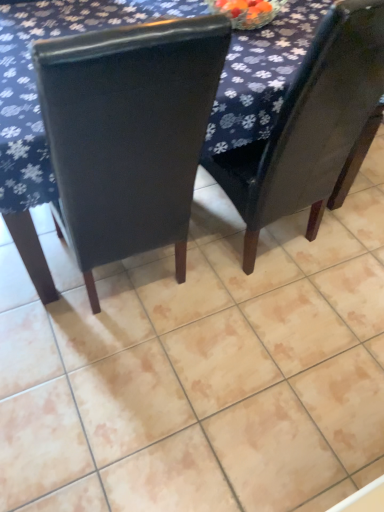
Question: Considering the relative sizes of matte black chair at center, acting as the 1th chair starting from the right, and dark blue fabric at upper center in the image provided, is matte black chair at center, acting as the 1th chair starting from the right, shorter than dark blue fabric at upper center?

Choices:
 (A) no
 (B) yes

Answer: (A)

Question: From the image's perspective, is matte black chair at center, which ranks as the second chair in left-to-right order, over dark blue fabric at upper center?

Choices:
 (A) yes
 (B) no

Answer: (B)

Question: Can you confirm if matte black chair at center, acting as the 1th chair starting from the right, is positioned to the right of dark blue fabric at upper center?

Choices:
 (A) no
 (B) yes

Answer: (B)

Question: From a real-world perspective, is matte black chair at center, acting as the 1th chair starting from the right, below dark blue fabric at upper center?

Choices:
 (A) yes
 (B) no

Answer: (B)

Question: Does matte black chair at center, acting as the 1th chair starting from the right, come in front of dark blue fabric at upper center?

Choices:
 (A) yes
 (B) no

Answer: (A)

Question: Is matte black chair at center, which ranks as the second chair in left-to-right order, in contact with dark blue fabric at upper center?

Choices:
 (A) no
 (B) yes

Answer: (A)

Question: Does matte black chair at center, which ranks as the second chair in left-to-right order, have a greater height compared to matte black chair at center, which appears as the 1th chair when viewed from the left?

Choices:
 (A) yes
 (B) no

Answer: (A)

Question: From the image's perspective, is matte black chair at center, which ranks as the second chair in left-to-right order, beneath matte black chair at center, which appears as the 1th chair when viewed from the left?

Choices:
 (A) no
 (B) yes

Answer: (A)

Question: Does matte black chair at center, acting as the 1th chair starting from the right, touch matte black chair at center, acting as the 2th chair starting from the right?

Choices:
 (A) yes
 (B) no

Answer: (B)

Question: Can you confirm if matte black chair at center, which ranks as the second chair in left-to-right order, is wider than matte black chair at center, which appears as the 1th chair when viewed from the left?

Choices:
 (A) yes
 (B) no

Answer: (B)

Question: From the image's perspective, is matte black chair at center, which ranks as the second chair in left-to-right order, over matte black chair at center, acting as the 2th chair starting from the right?

Choices:
 (A) no
 (B) yes

Answer: (B)

Question: Is matte black chair at center, which ranks as the second chair in left-to-right order, not within matte black chair at center, which appears as the 1th chair when viewed from the left?

Choices:
 (A) yes
 (B) no

Answer: (A)

Question: Does matte black chair at center, acting as the 2th chair starting from the right, have a larger size compared to dark blue fabric at upper center?

Choices:
 (A) no
 (B) yes

Answer: (A)